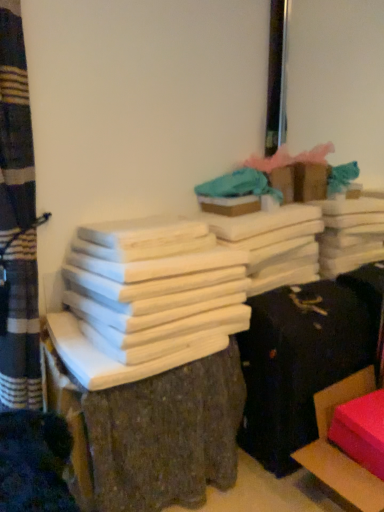
Question: In the image, is rubberized pink cushion at lower right, the 2th furniture in the left-to-right sequence, on the left side or the right side of smooth wood stack at center, acting as the 2th furniture starting from the right?

Choices:
 (A) right
 (B) left

Answer: (A)

Question: Which is correct: rubberized pink cushion at lower right, arranged as the first furniture when viewed from the right, is inside smooth wood stack at center, marked as the 1th furniture in a left-to-right arrangement, or outside of it?

Choices:
 (A) outside
 (B) inside

Answer: (A)

Question: Which object is positioned farthest from the white matte wood at center?

Choices:
 (A) smooth wood stack at center, marked as the 1th furniture in a left-to-right arrangement
 (B) teal fabric at upper center
 (C) rubberized pink cushion at lower right, the 2th furniture in the left-to-right sequence

Answer: (C)

Question: Which is nearer to the rubberized pink cushion at lower right, arranged as the first furniture when viewed from the right?

Choices:
 (A) smooth wood stack at center, marked as the 1th furniture in a left-to-right arrangement
 (B) teal fabric at upper center
 (C) white matte wood at center

Answer: (A)